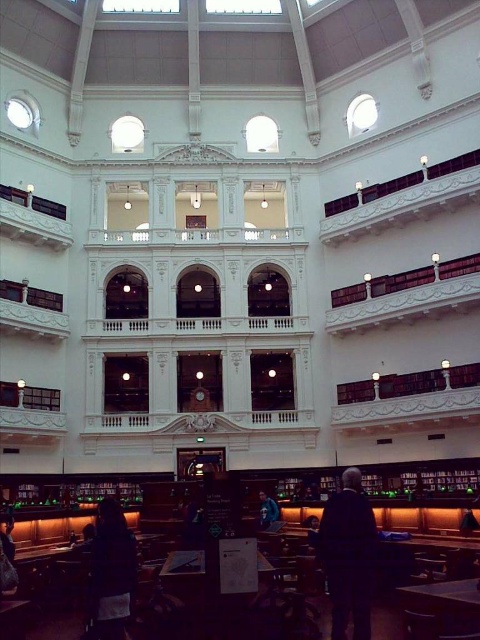
Question: Is dark suit at lower center thinner than wooden table at lower right?

Choices:
 (A) no
 (B) yes

Answer: (A)

Question: Does dark suit at lower center appear on the right side of dark blue fabric jacket at center?

Choices:
 (A) no
 (B) yes

Answer: (B)

Question: Which object appears farthest from the camera in this image?

Choices:
 (A) dark fabric jacket at lower left
 (B) dark suit at lower center
 (C) wooden table at lower right

Answer: (B)

Question: Which point is farther from the camera taking this photo?

Choices:
 (A) (338, 588)
 (B) (419, 596)

Answer: (A)

Question: Does dark fabric jacket at lower left have a smaller size compared to dark blue fabric jacket at center?

Choices:
 (A) yes
 (B) no

Answer: (B)

Question: Which point is farther from the camera taking this photo?

Choices:
 (A) (271, 524)
 (B) (97, 538)
 (C) (348, 506)

Answer: (A)